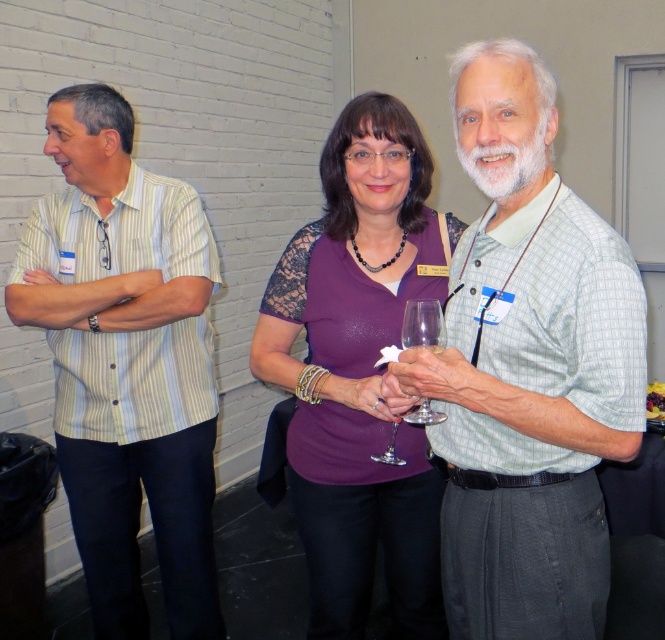
In the image of the social gathering, there are a light green plaid shirt at center and a clear glass wine glass at center. Which object is positioned to the right of the other?

The light green plaid shirt at center is to the right of the clear glass wine glass at center.